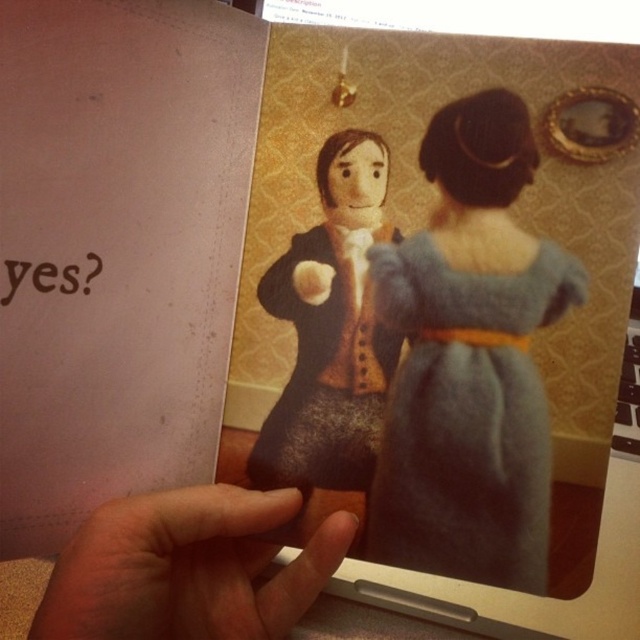
Question: Which object appears closest to the camera in this image?

Choices:
 (A) fuzzy skin at lower left
 (B) blue felt dress at center

Answer: (A)

Question: From the image, what is the correct spatial relationship of blue felt dress at center in relation to fuzzy skin at lower left?

Choices:
 (A) right
 (B) left

Answer: (A)

Question: Which point is closer to the camera taking this photo?

Choices:
 (A) (180, 524)
 (B) (518, 273)

Answer: (A)

Question: Does blue felt dress at center have a larger size compared to fuzzy skin at lower left?

Choices:
 (A) yes
 (B) no

Answer: (B)

Question: Does blue felt dress at center come behind fuzzy skin at lower left?

Choices:
 (A) yes
 (B) no

Answer: (A)